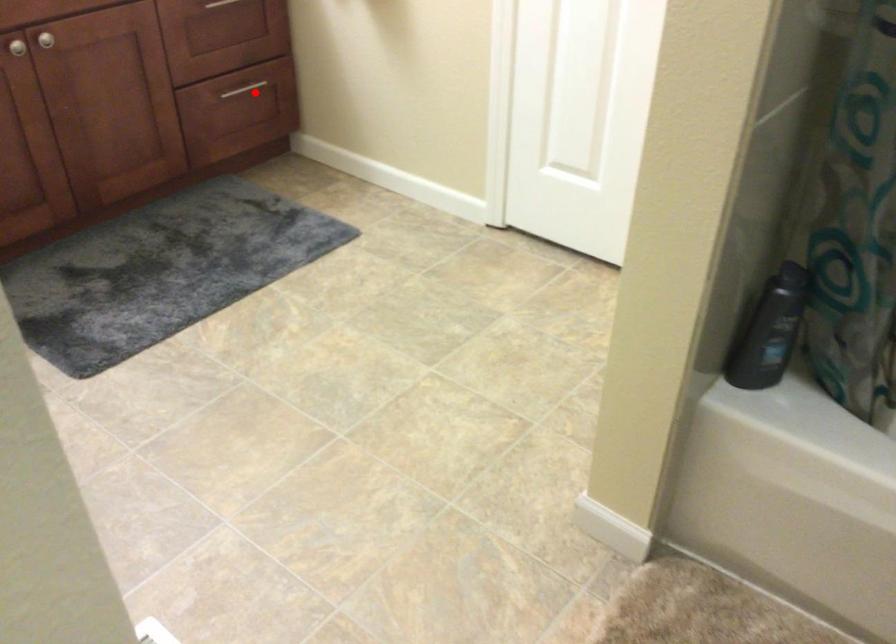
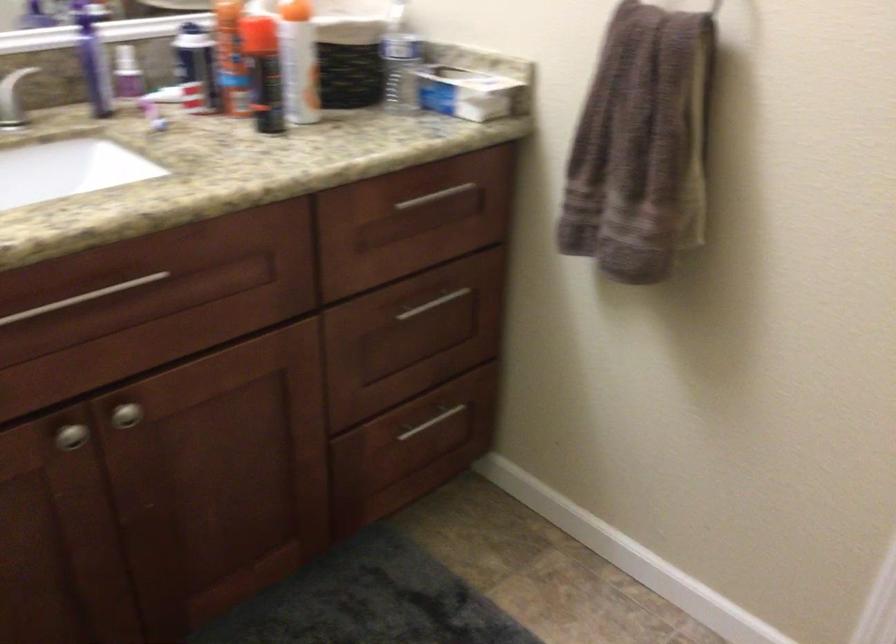
Where in the second image is the point corresponding to the highlighted location from the first image?

(432, 422)